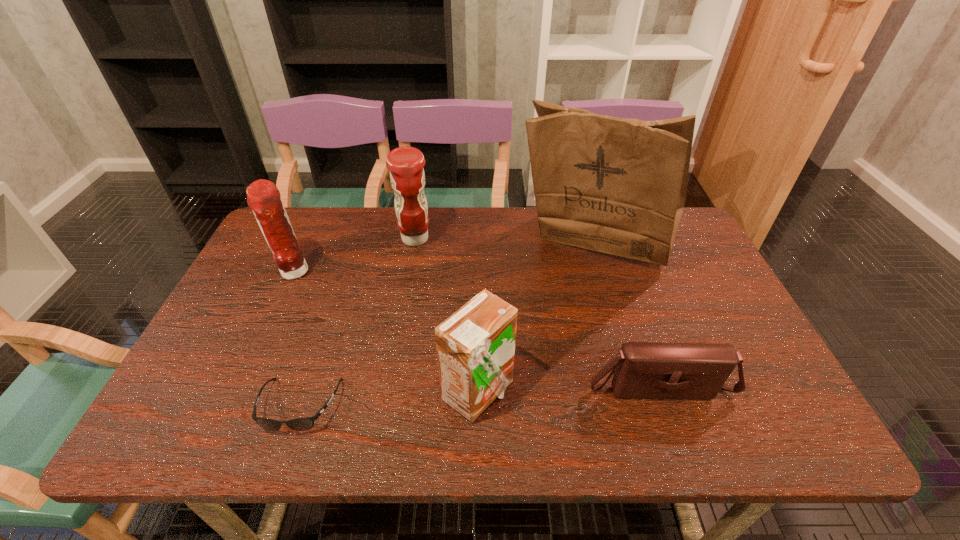
Image resolution: width=960 pixels, height=540 pixels. I want to click on the tallest object, so click(618, 186).

Identify the location of the farther condiment. This screenshot has width=960, height=540. (407, 176).

Locate an element on the screen. The width and height of the screenshot is (960, 540). the right condiment is located at coordinates (407, 176).

Where is `the nearer condiment`? Image resolution: width=960 pixels, height=540 pixels. the nearer condiment is located at coordinates (263, 197).

I want to click on the left condiment, so click(263, 197).

The height and width of the screenshot is (540, 960). Identify the location of the third object from right to left. (475, 346).

You are a GUI agent. You are given a task and a screenshot of the screen. Output one action in this format:
    pyautogui.click(x=<x>, y=<y>)
    Task: Click on the carton
    The height and width of the screenshot is (540, 960).
    Given the screenshot: What is the action you would take?
    pyautogui.click(x=475, y=346)

You are a GUI agent. You are given a task and a screenshot of the screen. Output one action in this format:
    pyautogui.click(x=<x>, y=<y>)
    Task: Click on the shoulder bag
    
    Given the screenshot: What is the action you would take?
    pyautogui.click(x=644, y=370)

Locate an element on the screen. The image size is (960, 540). the shortest object is located at coordinates (300, 424).

Identify the location of the second object from left to right. (300, 424).